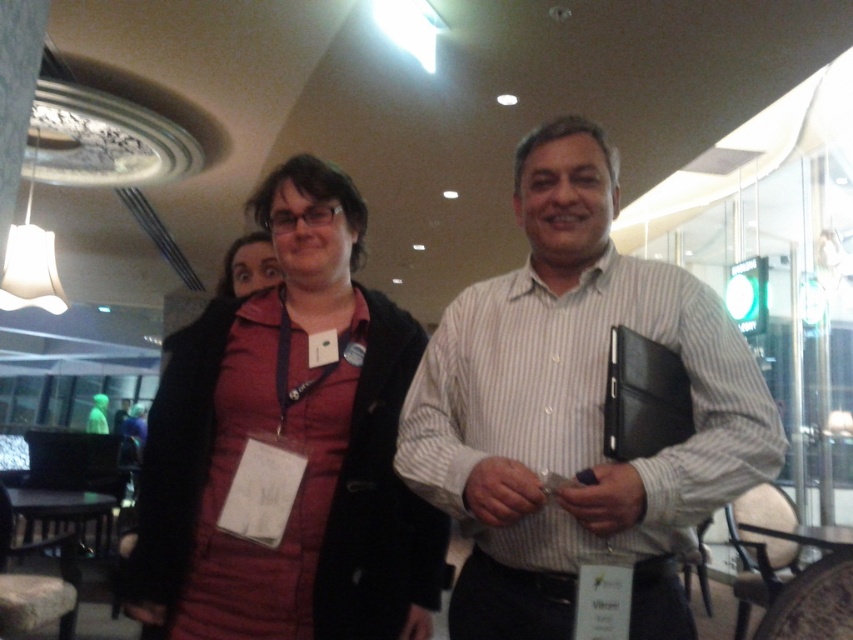
Question: Which point is closer to the camera?

Choices:
 (A) (241, 269)
 (B) (496, 550)
 (C) (305, 285)

Answer: (B)

Question: Among these points, which one is nearest to the camera?

Choices:
 (A) (374, 556)
 (B) (502, 544)

Answer: (B)

Question: Which point is closer to the camera?

Choices:
 (A) pos(303,330)
 (B) pos(250,252)

Answer: (A)

Question: Does matte black folder at center have a smaller size compared to matte red coat at center?

Choices:
 (A) no
 (B) yes

Answer: (A)

Question: Is matte black folder at center positioned before matte red vest at center?

Choices:
 (A) no
 (B) yes

Answer: (B)

Question: Does matte red vest at center appear over matte red coat at center?

Choices:
 (A) no
 (B) yes

Answer: (A)